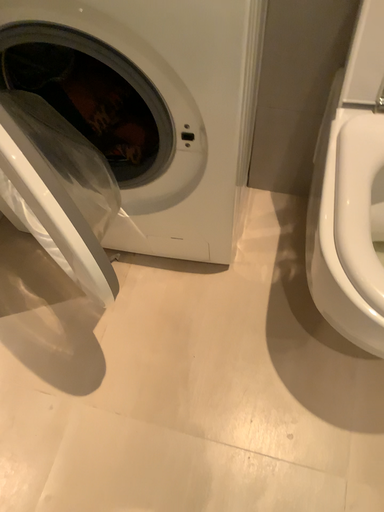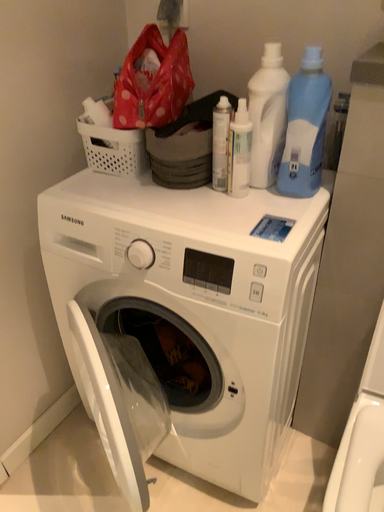
Question: Which way did the camera rotate in the video?

Choices:
 (A) rotated upward
 (B) rotated downward

Answer: (A)